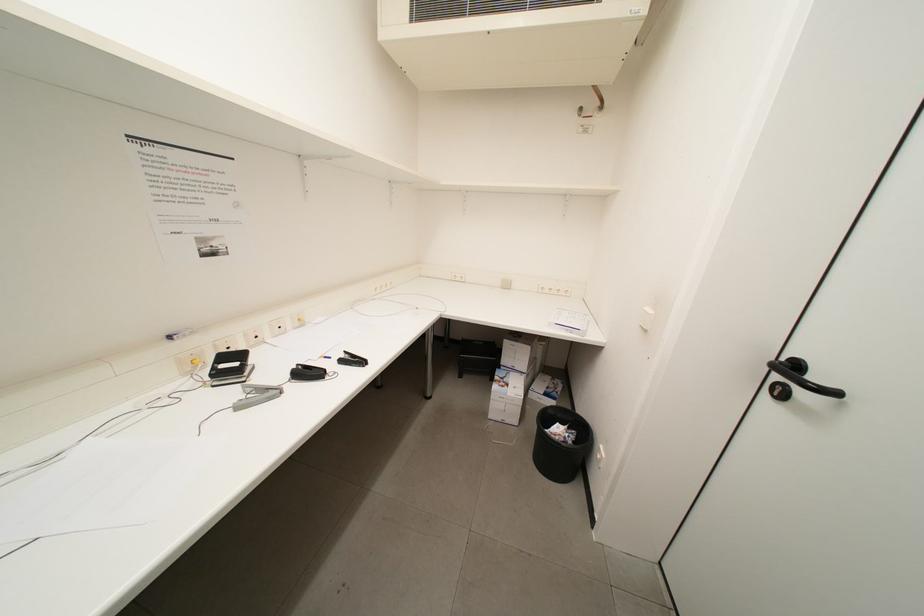
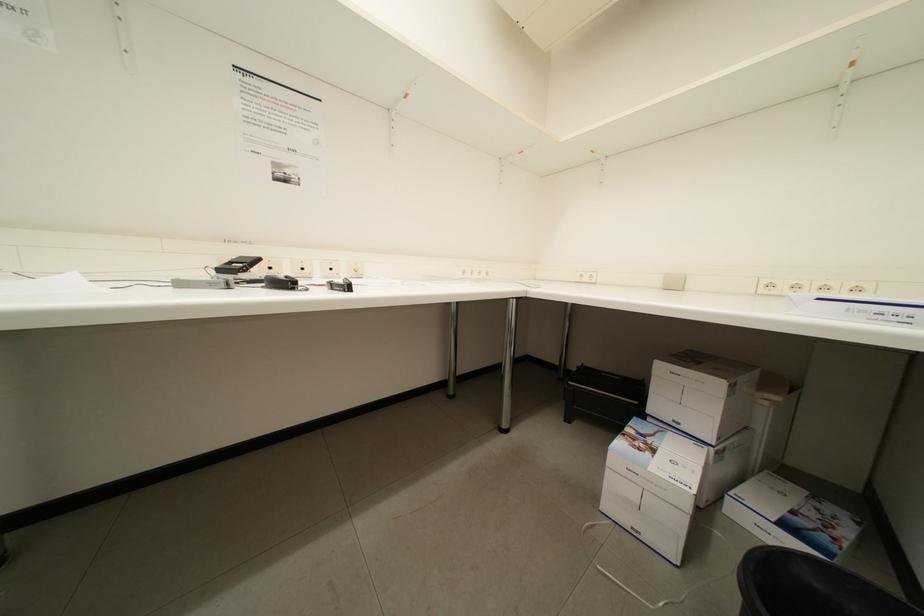
Question: How did the camera likely rotate?

Choices:
 (A) Left
 (B) Right
 (C) Up
 (D) Down

Answer: (A)